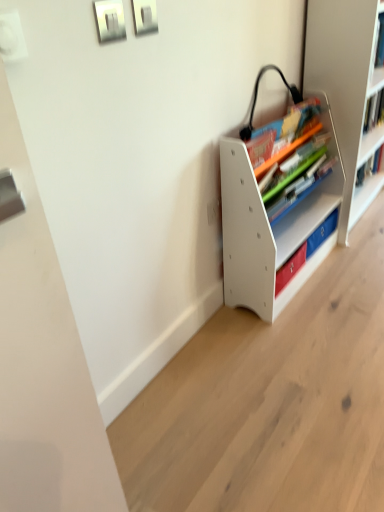
The height and width of the screenshot is (512, 384). I want to click on white matte bookshelf at center, the 2th shelf from the right, so click(x=269, y=227).

The height and width of the screenshot is (512, 384). Describe the element at coordinates (347, 89) in the screenshot. I see `white plastic bookshelf at right, which is counted as the 2th shelf, starting from the left` at that location.

I want to click on white matte bookshelf at center, which is the first shelf from left to right, so click(269, 227).

Could matte plastic books at center be considered to be inside white matte bookshelf at center, the 2th shelf from the right?

Yes, white matte bookshelf at center, the 2th shelf from the right, contains matte plastic books at center.

Can you confirm if white matte bookshelf at center, which is the first shelf from left to right, is taller than matte plastic books at center?

Correct, white matte bookshelf at center, which is the first shelf from left to right, is much taller as matte plastic books at center.

How different are the orientations of white matte bookshelf at center, the 2th shelf from the right, and matte plastic books at center in degrees?

They differ by 0.946 degrees in their facing directions.

Is white matte bookshelf at center, the 2th shelf from the right, oriented towards matte plastic books at center?

Yes, white matte bookshelf at center, the 2th shelf from the right, is facing matte plastic books at center.

Is white plastic bookshelf at right, the first shelf positioned from the right, oriented away from matte plastic books at center?

white plastic bookshelf at right, the first shelf positioned from the right, is not turned away from matte plastic books at center.

Which is more to the right, white plastic bookshelf at right, the first shelf positioned from the right, or matte plastic books at center?

From the viewer's perspective, white plastic bookshelf at right, the first shelf positioned from the right, appears more on the right side.

Can you confirm if white plastic bookshelf at right, the first shelf positioned from the right, is taller than matte plastic books at center?

Yes, white plastic bookshelf at right, the first shelf positioned from the right, is taller than matte plastic books at center.

Based on the photo, considering the relative sizes of white matte bookshelf at center, the 2th shelf from the right, and white plastic bookshelf at right, the first shelf positioned from the right, in the image provided, is white matte bookshelf at center, the 2th shelf from the right, bigger than white plastic bookshelf at right, the first shelf positioned from the right,?

Actually, white matte bookshelf at center, the 2th shelf from the right, might be smaller than white plastic bookshelf at right, the first shelf positioned from the right.

Is white matte bookshelf at center, which is the first shelf from left to right, next to white plastic bookshelf at right, the first shelf positioned from the right, and touching it?

white matte bookshelf at center, which is the first shelf from left to right, and white plastic bookshelf at right, the first shelf positioned from the right, are not in contact.

From a real-world perspective, which object rests below the other?

white matte bookshelf at center, the 2th shelf from the right.

Is white plastic bookshelf at right, which is counted as the 2th shelf, starting from the left, completely or partially inside white matte bookshelf at center, the 2th shelf from the right?

No, white matte bookshelf at center, the 2th shelf from the right, does not contain white plastic bookshelf at right, which is counted as the 2th shelf, starting from the left.

Which of these two, matte plastic books at center or white matte bookshelf at center, the 2th shelf from the right, is smaller?

matte plastic books at center is smaller.

From the image's perspective, which is below, matte plastic books at center or white matte bookshelf at center, the 2th shelf from the right?

white matte bookshelf at center, the 2th shelf from the right, appears lower in the image.

Is matte plastic books at center shorter than white matte bookshelf at center, which is the first shelf from left to right?

Yes, matte plastic books at center is shorter than white matte bookshelf at center, which is the first shelf from left to right.

Which is behind, matte plastic books at center or white matte bookshelf at center, which is the first shelf from left to right?

matte plastic books at center is more distant.

How distant is white plastic bookshelf at right, which is counted as the 2th shelf, starting from the left, from white matte bookshelf at center, the 2th shelf from the right?

white plastic bookshelf at right, which is counted as the 2th shelf, starting from the left, and white matte bookshelf at center, the 2th shelf from the right, are 34.64 centimeters apart.

From the picture: Could you tell me if white plastic bookshelf at right, the first shelf positioned from the right, is turned towards white matte bookshelf at center, the 2th shelf from the right?

No, white plastic bookshelf at right, the first shelf positioned from the right, does not turn towards white matte bookshelf at center, the 2th shelf from the right.

From a real-world perspective, between white plastic bookshelf at right, which is counted as the 2th shelf, starting from the left, and white matte bookshelf at center, the 2th shelf from the right, who is vertically higher?

white plastic bookshelf at right, which is counted as the 2th shelf, starting from the left.

Locate an element on the screen. shelf below the white plastic bookshelf at right, which is counted as the 2th shelf, starting from the left (from the image's perspective) is located at coordinates (269, 227).

From the picture: Is white plastic bookshelf at right, the first shelf positioned from the right, inside matte plastic books at center?

That's incorrect, white plastic bookshelf at right, the first shelf positioned from the right, is not inside matte plastic books at center.

Which object is closer to the camera, matte plastic books at center or white plastic bookshelf at right, which is counted as the 2th shelf, starting from the left?

matte plastic books at center.

Is matte plastic books at center facing away from white plastic bookshelf at right, the first shelf positioned from the right?

No.

What's the angular difference between matte plastic books at center and white plastic bookshelf at right, the first shelf positioned from the right,'s facing directions?

The angle between the facing direction of matte plastic books at center and the facing direction of white plastic bookshelf at right, the first shelf positioned from the right, is 0.197 degrees.

Image resolution: width=384 pixels, height=512 pixels. Find the location of `shelf in front of the matte plastic books at center`. shelf in front of the matte plastic books at center is located at coordinates (269, 227).

In order to click on book on the left side of white plastic bookshelf at right, the first shelf positioned from the right in this screenshot , I will do 292,159.

Considering their positions, is white plastic bookshelf at right, which is counted as the 2th shelf, starting from the left, positioned further to white matte bookshelf at center, which is the first shelf from left to right, than matte plastic books at center?

white plastic bookshelf at right, which is counted as the 2th shelf, starting from the left, is further to white matte bookshelf at center, which is the first shelf from left to right.

Considering their positions, is white matte bookshelf at center, which is the first shelf from left to right, positioned further to white plastic bookshelf at right, the first shelf positioned from the right, than matte plastic books at center?

The object further to white plastic bookshelf at right, the first shelf positioned from the right, is white matte bookshelf at center, which is the first shelf from left to right.

Estimate the real-world distances between objects in this image. Which object is closer to white plastic bookshelf at right, which is counted as the 2th shelf, starting from the left, matte plastic books at center or white matte bookshelf at center, which is the first shelf from left to right?

Among the two, matte plastic books at center is located nearer to white plastic bookshelf at right, which is counted as the 2th shelf, starting from the left.

When comparing their distances from white matte bookshelf at center, the 2th shelf from the right, does matte plastic books at center or white plastic bookshelf at right, the first shelf positioned from the right, seem closer?

matte plastic books at center.

Looking at the image, which one is located further to matte plastic books at center, white plastic bookshelf at right, the first shelf positioned from the right, or white matte bookshelf at center, which is the first shelf from left to right?

Based on the image, white plastic bookshelf at right, the first shelf positioned from the right, appears to be further to matte plastic books at center.

Estimate the real-world distances between objects in this image. Which object is further from matte plastic books at center, white matte bookshelf at center, the 2th shelf from the right, or white plastic bookshelf at right, which is counted as the 2th shelf, starting from the left?

white plastic bookshelf at right, which is counted as the 2th shelf, starting from the left.

Image resolution: width=384 pixels, height=512 pixels. I want to click on shelf between matte plastic books at center and white plastic bookshelf at right, the first shelf positioned from the right, so click(269, 227).